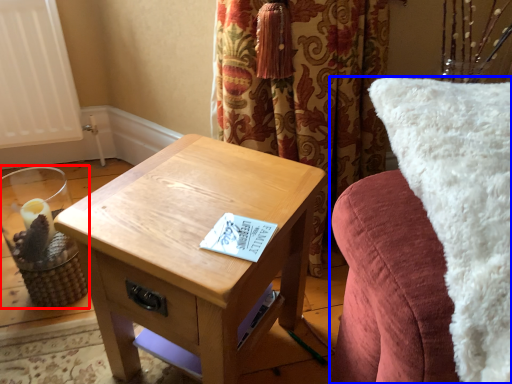
Question: Which of the following is the closest to the observer, candle holder (highlighted by a red box) or furniture (highlighted by a blue box)?

Choices:
 (A) candle holder
 (B) furniture

Answer: (B)